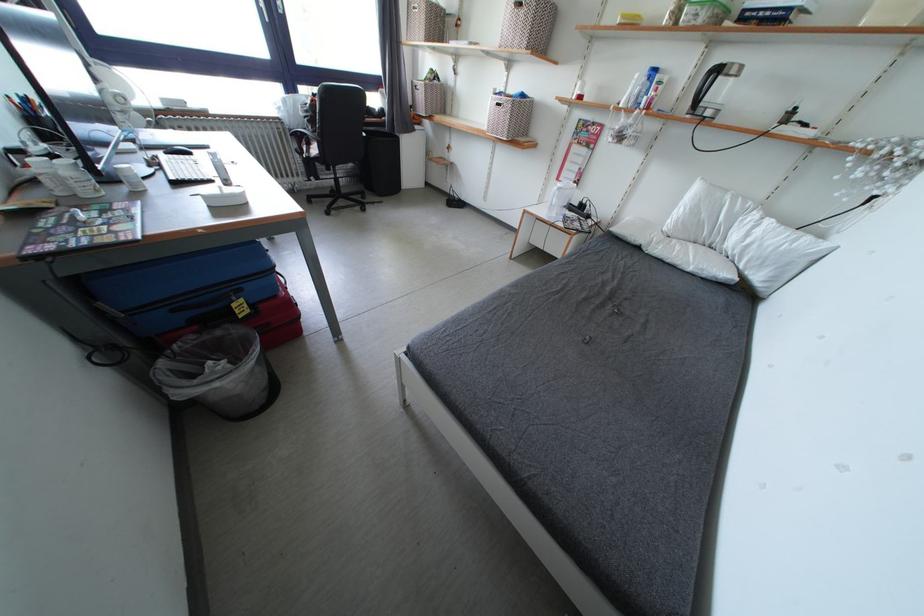
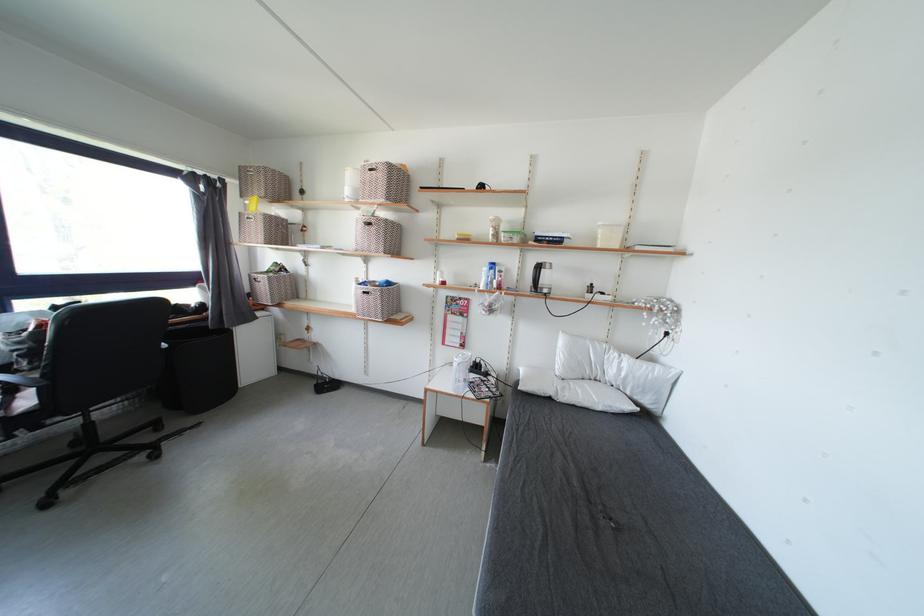
Where in the second image is the point corresponding to (646,253) from the first image?

(556, 403)